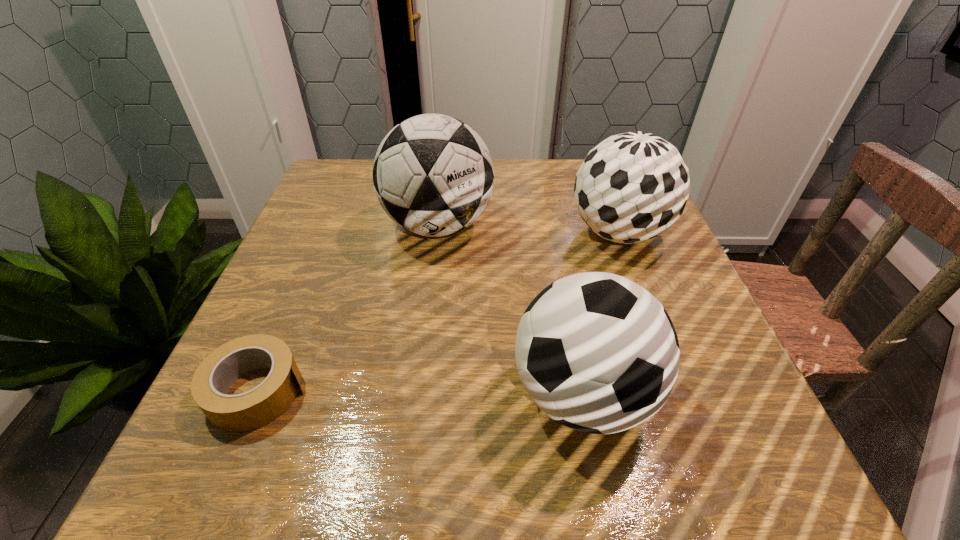
Identify the location of the second object from left to right. (433, 175).

In order to click on the nearest soccer ball in this screenshot , I will do `click(596, 352)`.

Where is `the leftmost object`? Image resolution: width=960 pixels, height=540 pixels. the leftmost object is located at coordinates (250, 410).

Identify the location of duct tape. (250, 410).

Image resolution: width=960 pixels, height=540 pixels. I want to click on vacant region located 0.170m on the surface of the third object from right to left where the brand logo is visible, so click(426, 324).

Find the location of a particular element. This screenshot has width=960, height=540. free region located 0.270m on the back of the nearest soccer ball is located at coordinates (553, 242).

In order to click on free space located 0.250m at the edge of the shortest object in this screenshot , I will do `click(466, 390)`.

What are the coordinates of `soccer ball positioned at the near edge` in the screenshot? It's located at (596, 352).

Where is `duct tape at the near edge`? duct tape at the near edge is located at coordinates (250, 410).

Find the location of a particular element. object present at the left edge is located at coordinates (250, 410).